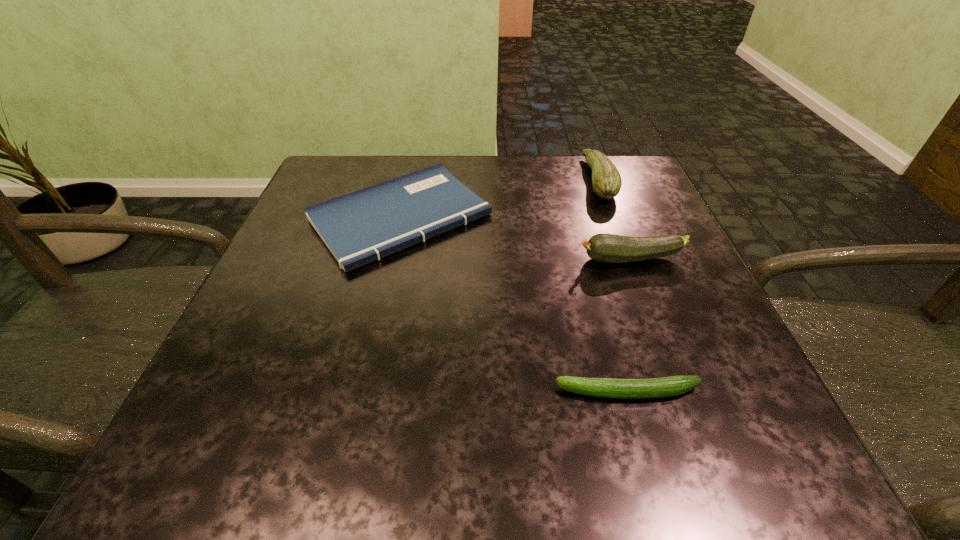
In the image, there is a desktop. Identify the location of vacant space at the far edge. (532, 163).

I want to click on vacant space at the near edge of the desktop, so click(x=523, y=426).

At what (x,y) coordinates should I click in order to perform the action: click on free spot at the left edge of the desktop. Please return your answer as a coordinate pair (x, y). This screenshot has height=540, width=960. Looking at the image, I should click on (305, 291).

Identify the location of free location at the right edge of the desktop. This screenshot has height=540, width=960. (671, 260).

The image size is (960, 540). I want to click on vacant region at the far left corner of the desktop, so click(x=383, y=176).

Where is `blank space at the near left corner`? This screenshot has height=540, width=960. blank space at the near left corner is located at coordinates (225, 413).

Where is `free space at the far right corner of the desktop`? This screenshot has height=540, width=960. free space at the far right corner of the desktop is located at coordinates (630, 208).

In order to click on vacant area at the near right corner of the desktop in this screenshot , I will do `click(721, 474)`.

Locate an element on the screen. free point between the farthest zucchini and the paperback book is located at coordinates click(499, 198).

Image resolution: width=960 pixels, height=540 pixels. What are the coordinates of `free space between the nearest object and the second farthest zucchini` in the screenshot? It's located at (629, 326).